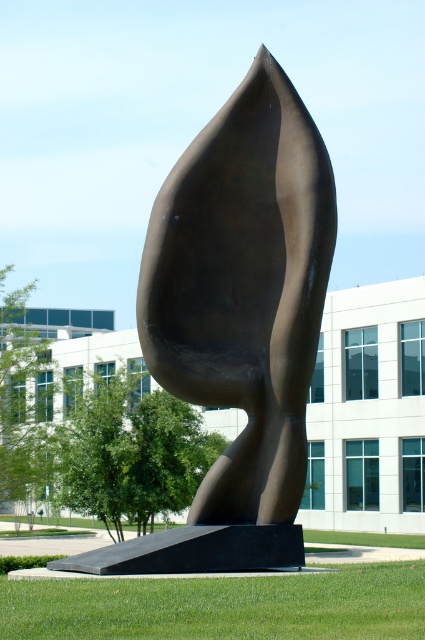
Who is more forward, (x=159, y=349) or (x=345, y=564)?

Point (x=159, y=349) is more forward.

How much distance is there between bronze sculpture at center and green grass at lower center?

bronze sculpture at center and green grass at lower center are 20.53 feet apart.

What do you see at coordinates (237, 323) in the screenshot? I see `bronze sculpture at center` at bounding box center [237, 323].

Find the location of a particular element. The height and width of the screenshot is (640, 425). bronze sculpture at center is located at coordinates point(237,323).